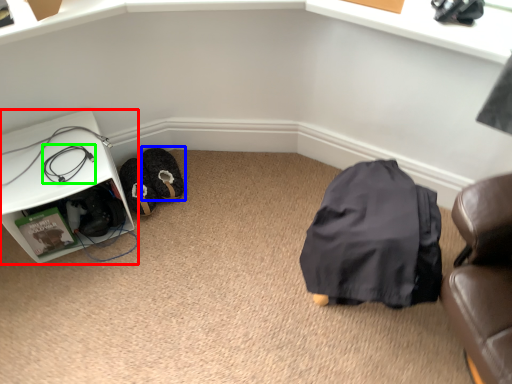
Question: Which object is positioned closest to furniture (highlighted by a red box)? Select from footwear (highlighted by a blue box) and wire (highlighted by a green box).

Choices:
 (A) footwear
 (B) wire

Answer: (B)